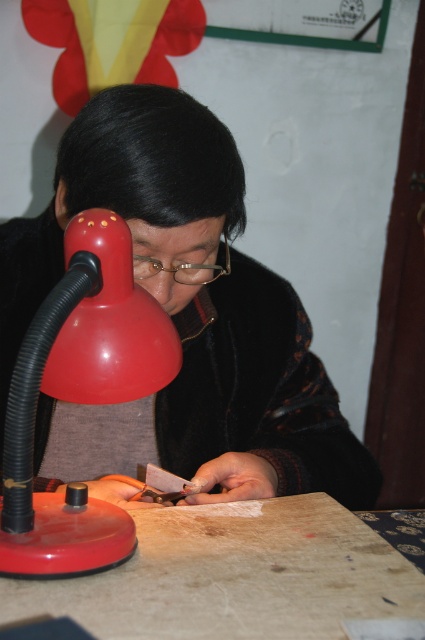
Which of these two, matte black jacket at center or wooden table at lower center, stands taller?

matte black jacket at center

This screenshot has height=640, width=425. What are the coordinates of `matte black jacket at center` in the screenshot? It's located at (183, 317).

Does matte black jacket at center appear on the left side of matte plastic desk lamp at left?

In fact, matte black jacket at center is to the right of matte plastic desk lamp at left.

Between matte black jacket at center and matte plastic desk lamp at left, which one has more height?

matte black jacket at center

Who is more forward, [144,282] or [101,376]?

Point [101,376]

Where is `matte black jacket at center`? The width and height of the screenshot is (425, 640). matte black jacket at center is located at coordinates (183, 317).

Which of these two, wooden table at lower center or matte plastic desk lamp at left, stands taller?

matte plastic desk lamp at left

Is point (317, 564) positioned after point (25, 534)?

That is True.

Is point (65, 589) closer to viewer compared to point (64, 342)?

Yes.

In order to click on wooden table at lower center in this screenshot , I will do `click(235, 576)`.